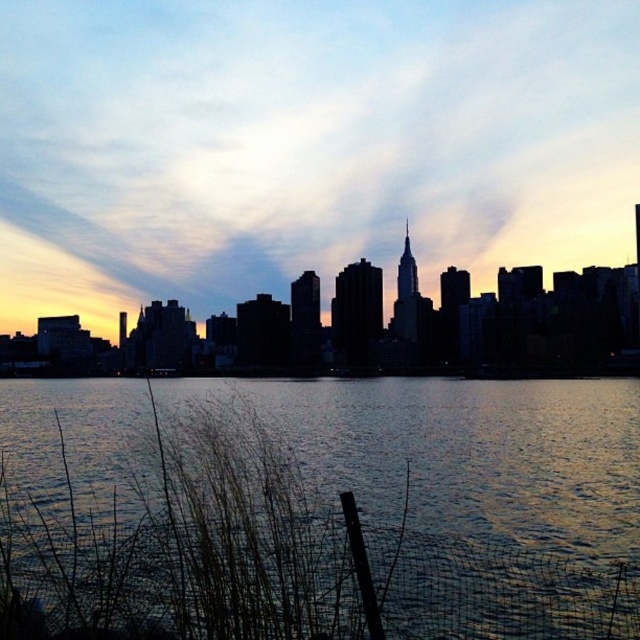
Between dark water at center and silhouette skyline at center, which one appears on the left side from the viewer's perspective?

silhouette skyline at center

Can you confirm if dark water at center is thinner than silhouette skyline at center?

Yes.

Does point (96, 429) come farther from viewer compared to point (97, 342)?

That is False.

This screenshot has height=640, width=640. Identify the location of dark water at center. (176, 525).